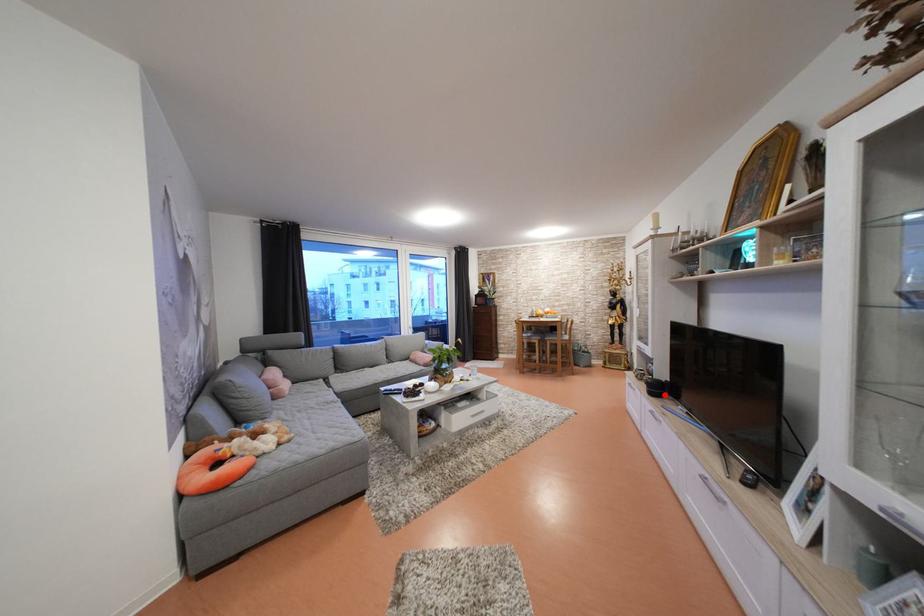
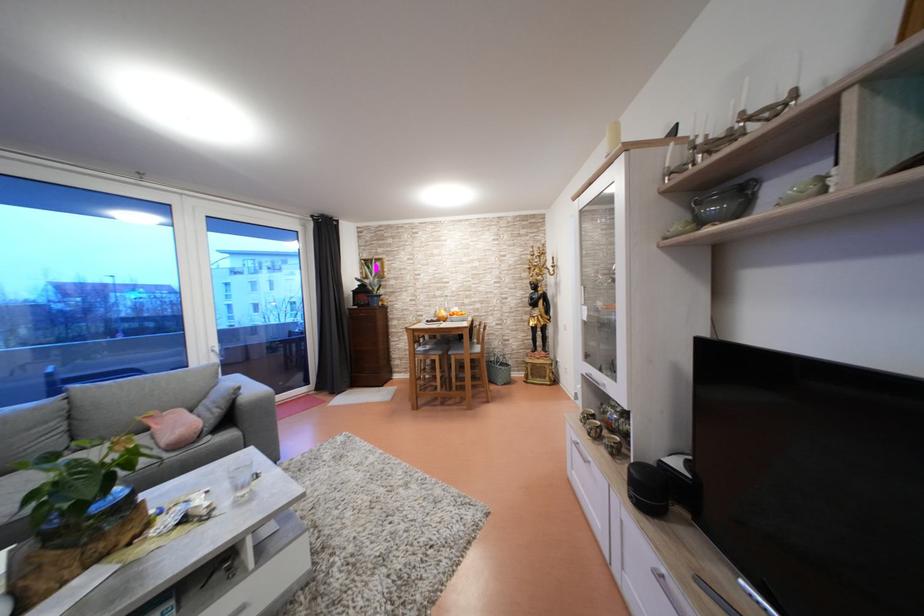
Question: I am providing you with two images of the same scene from different viewpoints. A red point is shown in image1. For the corresponding object point in image2, is it positioned nearer or farther from the camera?

Choices:
 (A) Nearer
 (B) Farther

Answer: (B)